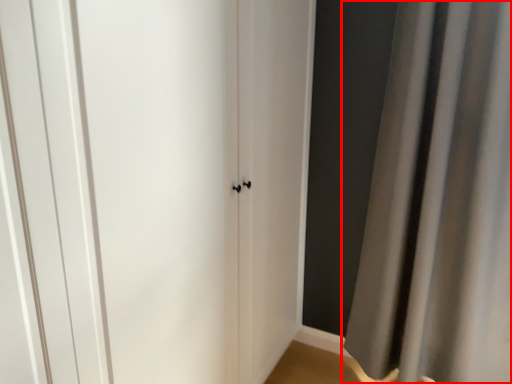
Question: Observing the image, what is the correct spatial positioning of curtain (annotated by the red box) in reference to door?

Choices:
 (A) left
 (B) right

Answer: (B)